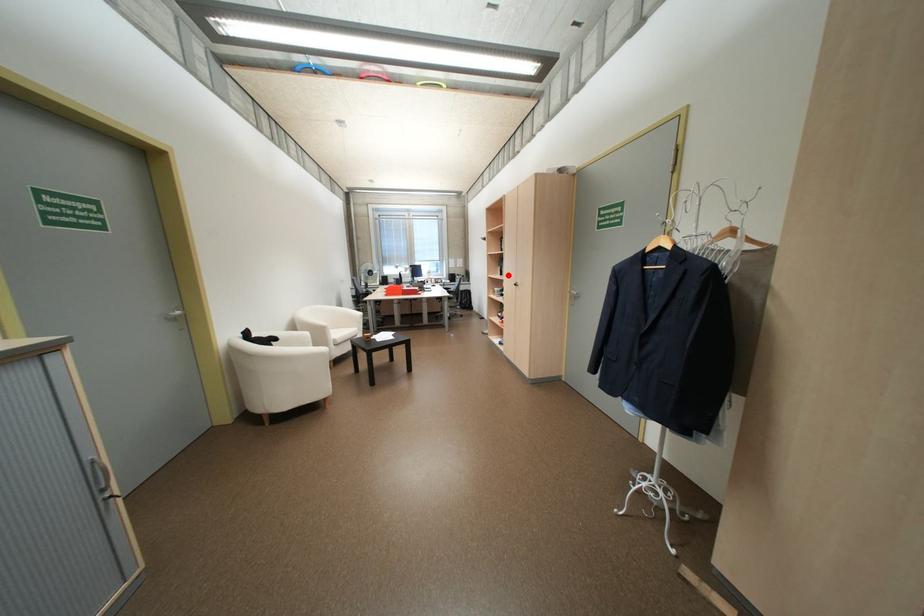
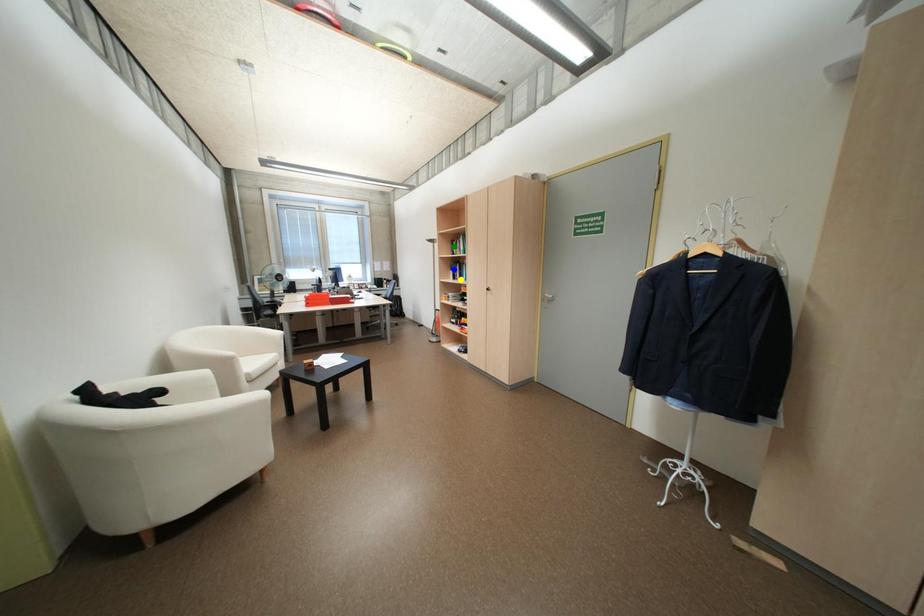
Question: I am providing you with two images of the same scene from different viewpoints. A red point is marked on the first image. You are given multiple points on the second image. In image 2, which mark is for the same physical point as the one in image 1?

Choices:
 (A) green point
 (B) yellow point
 (C) blue point

Answer: (B)